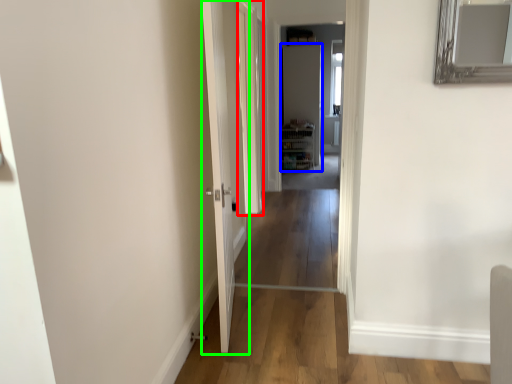
Question: Which object is positioned farthest from glass door (highlighted by a red box)? Select from door (highlighted by a blue box) and door (highlighted by a green box).

Choices:
 (A) door
 (B) door

Answer: (A)